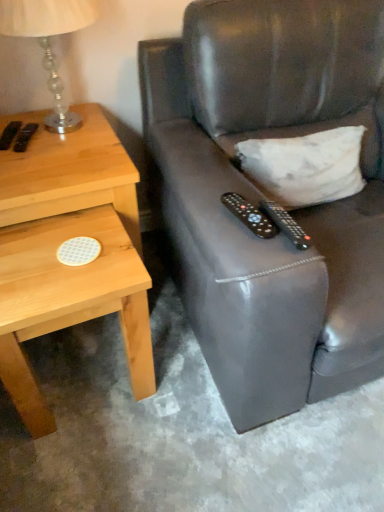
Question: Does white matte pillow at upper right appear on the left side of light wood/texture nightstand at left?

Choices:
 (A) yes
 (B) no

Answer: (B)

Question: Is white matte pillow at upper right far away from light wood/texture nightstand at left?

Choices:
 (A) no
 (B) yes

Answer: (A)

Question: Is white matte pillow at upper right wider than light wood/texture nightstand at left?

Choices:
 (A) yes
 (B) no

Answer: (B)

Question: Can you confirm if white matte pillow at upper right is thinner than light wood/texture nightstand at left?

Choices:
 (A) no
 (B) yes

Answer: (B)

Question: Can we say white matte pillow at upper right lies outside light wood/texture nightstand at left?

Choices:
 (A) no
 (B) yes

Answer: (B)

Question: From the image's perspective, is translucent glass lamp at upper left located above or below black plastic remote control at center, the first remote control from the right?

Choices:
 (A) above
 (B) below

Answer: (A)

Question: From a real-world perspective, relative to black plastic remote control at center, the first remote control from the right, is translucent glass lamp at upper left vertically above or below?

Choices:
 (A) above
 (B) below

Answer: (A)

Question: Which is correct: translucent glass lamp at upper left is inside black plastic remote control at center, which ranks as the second remote control in left-to-right order, or outside of it?

Choices:
 (A) outside
 (B) inside

Answer: (A)

Question: Is point click(49, 10) positioned closer to the camera than point click(288, 212)?

Choices:
 (A) farther
 (B) closer

Answer: (B)

Question: Considering their positions, is light wood/texture nightstand at left located in front of or behind translucent glass lamp at upper left?

Choices:
 (A) behind
 (B) front

Answer: (A)

Question: From a real-world perspective, relative to translucent glass lamp at upper left, is light wood/texture nightstand at left vertically above or below?

Choices:
 (A) above
 (B) below

Answer: (B)

Question: In terms of width, does light wood/texture nightstand at left look wider or thinner when compared to translucent glass lamp at upper left?

Choices:
 (A) wide
 (B) thin

Answer: (A)

Question: In terms of height, does light wood/texture nightstand at left look taller or shorter compared to translucent glass lamp at upper left?

Choices:
 (A) tall
 (B) short

Answer: (A)

Question: Based on their positions, is translucent glass lamp at upper left located to the left or right of white matte pillow at upper right?

Choices:
 (A) right
 (B) left

Answer: (B)

Question: Relative to white matte pillow at upper right, is translucent glass lamp at upper left in front or behind?

Choices:
 (A) behind
 (B) front

Answer: (B)